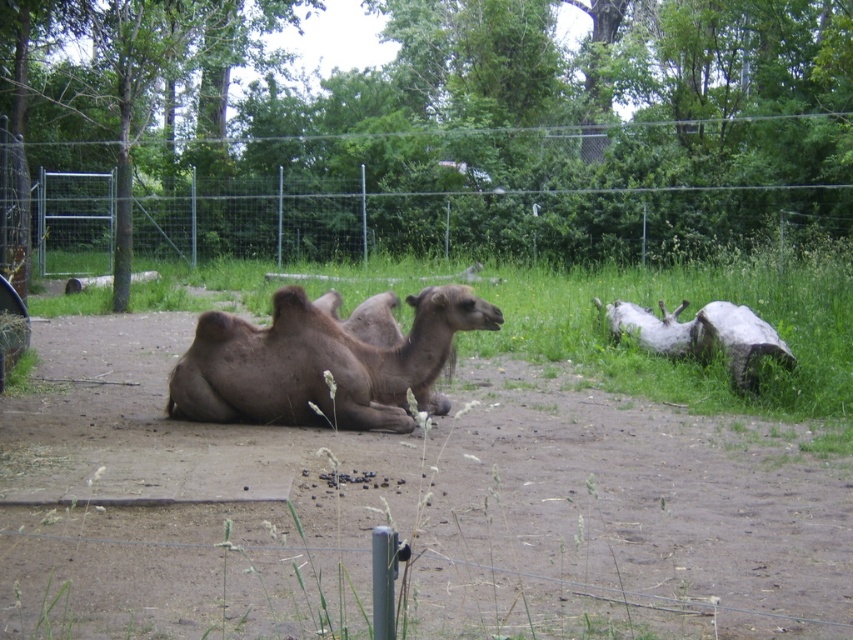
You are standing in front of the zoo enclosure and want to touch the metallic wire fence at upper center. Considering your arm length is 0.7 meters, can you reach it?

The metallic wire fence at upper center is 19.79 meters away from the viewer. Since your arm length is only 0.7 meters, you cannot reach it.

Looking at this image, you are a zookeeper who needs to measure the distance between the two camels in the enclosure. According to the image, how far apart are the brown matte camel at center and the brown rough camel at center?

The brown matte camel at center and the brown rough camel at center are 22.87 inches apart.

You are a zookeeper standing inside the enclosure. You need to place a new feeding trough made of brown rough wood at right near the metallic wire fence at upper center. Based on their positions, can you place the trough directly under the fence?

The metallic wire fence at upper center is located above the brown rough wood at right, so yes, you can place the trough directly under the fence since the fence is positioned above the wood.